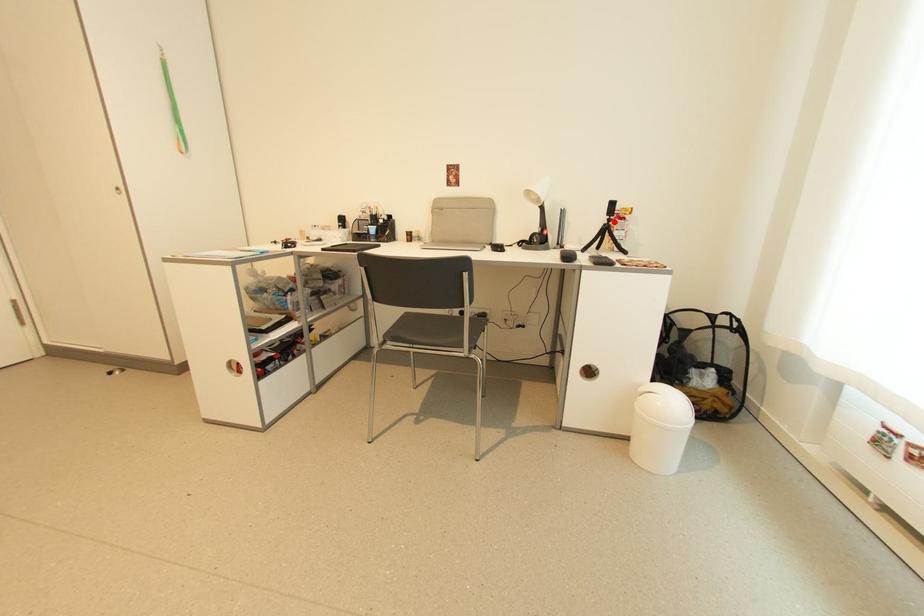
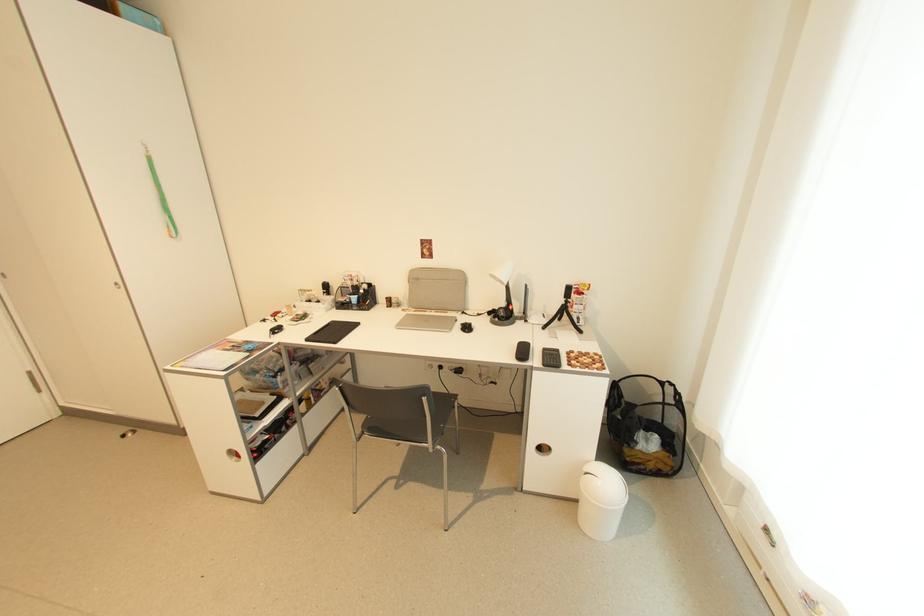
In the second image, find the point that corresponds to the highlighted location in the first image.

(572, 302)